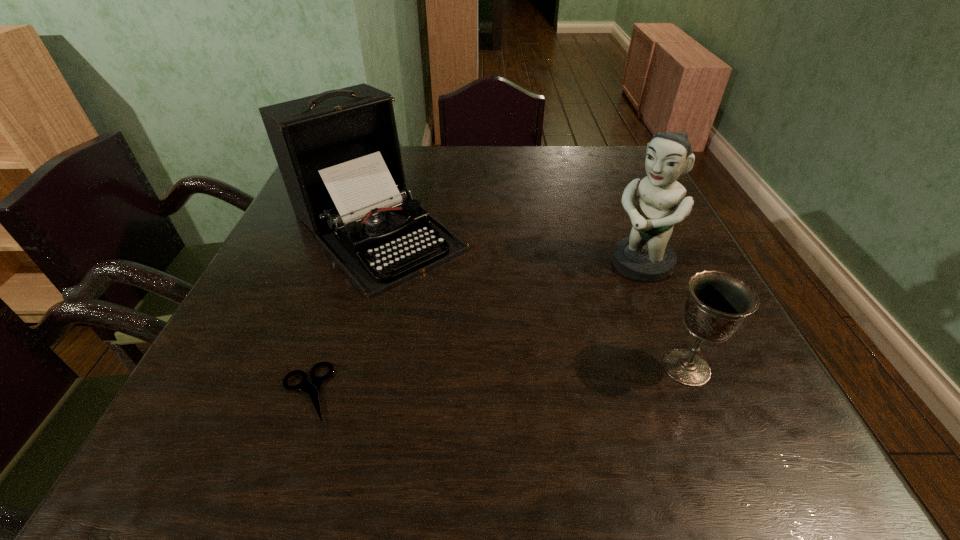
In order to click on vacant space that satisfies the following two spatial constraints: 1. on the back side of the figurine; 2. on the right side of the shears in this screenshot , I will do click(x=350, y=264).